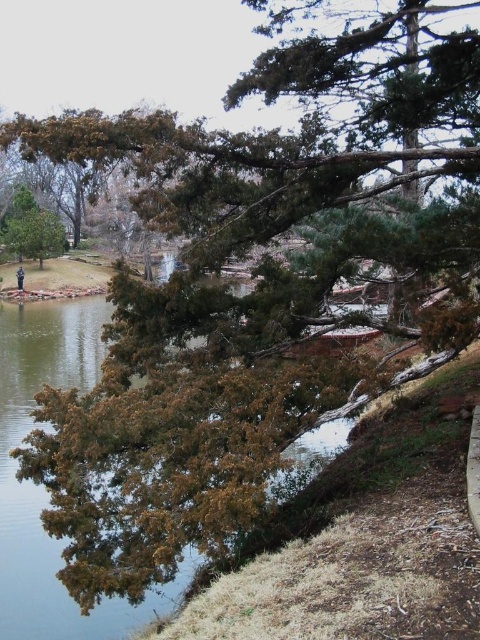
Is green needle-like at center to the left of clear water at lower left from the viewer's perspective?

In fact, green needle-like at center is to the right of clear water at lower left.

This screenshot has height=640, width=480. Describe the element at coordinates (294, 132) in the screenshot. I see `green needle-like at center` at that location.

Find the location of a particular element. green needle-like at center is located at coordinates (294, 132).

Identify the location of green needle-like at center. (x=294, y=132).

Between green needle-like at center and dark blue uniform at center, which one appears on the left side from the viewer's perspective?

dark blue uniform at center is more to the left.

Which of these two, green needle-like at center or dark blue uniform at center, stands taller?

With more height is green needle-like at center.

Between point (299, 51) and point (17, 269), which one is positioned behind?

The point (17, 269) is more distant.

Locate an element on the screen. This screenshot has width=480, height=640. green needle-like at center is located at coordinates (294, 132).

Can you confirm if clear water at lower left is shorter than dark blue uniform at center?

No.

How far apart are clear water at lower left and dark blue uniform at center?

clear water at lower left is 14.69 meters from dark blue uniform at center.

Which is behind, point (119, 632) or point (24, 273)?

Point (24, 273)

Where is `clear water at lower left`? The width and height of the screenshot is (480, 640). clear water at lower left is located at coordinates tap(44, 488).